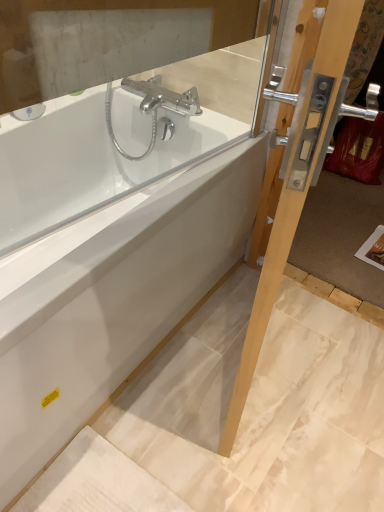
Question: Choose the correct answer: Is white glossy bathtub at center inside clear glass screen door at right or outside it?

Choices:
 (A) inside
 (B) outside

Answer: (B)

Question: Considering their positions, is white glossy bathtub at center located in front of or behind clear glass screen door at right?

Choices:
 (A) behind
 (B) front

Answer: (A)

Question: Is point (66, 279) positioned closer to the camera than point (306, 187)?

Choices:
 (A) closer
 (B) farther

Answer: (B)

Question: Visually, is clear glass screen door at right positioned to the left or to the right of white glossy bathtub at center?

Choices:
 (A) left
 (B) right

Answer: (B)

Question: Is clear glass screen door at right spatially inside white glossy bathtub at center, or outside of it?

Choices:
 (A) outside
 (B) inside

Answer: (A)

Question: Does point (342, 10) appear closer or farther from the camera than point (140, 270)?

Choices:
 (A) farther
 (B) closer

Answer: (B)

Question: From a real-world perspective, is clear glass screen door at right positioned above or below white glossy bathtub at center?

Choices:
 (A) above
 (B) below

Answer: (A)